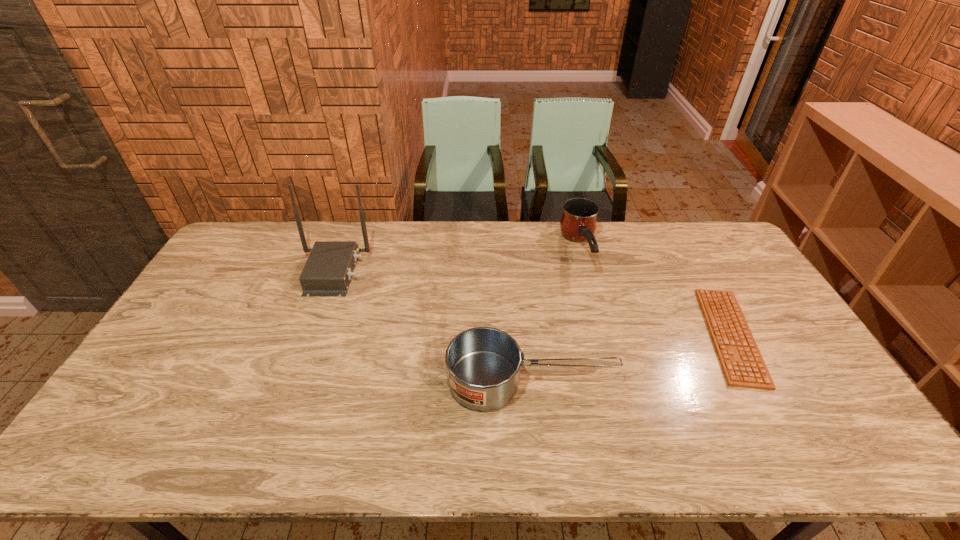
Find the location of a particular element. The height and width of the screenshot is (540, 960). the leftmost object is located at coordinates (328, 270).

This screenshot has width=960, height=540. I want to click on router, so click(x=328, y=270).

The height and width of the screenshot is (540, 960). Identify the location of the taller saucepan. (x=578, y=223).

The height and width of the screenshot is (540, 960). Find the location of `the farther saucepan`. the farther saucepan is located at coordinates (578, 223).

This screenshot has width=960, height=540. I want to click on the nearer saucepan, so click(483, 364).

Where is `the shorter saucepan`? This screenshot has height=540, width=960. the shorter saucepan is located at coordinates (483, 364).

You are a GUI agent. You are given a task and a screenshot of the screen. Output one action in this format:
    pyautogui.click(x=<x>, y=<y>)
    Task: Click on the computer keyboard
    
    Given the screenshot: What is the action you would take?
    pyautogui.click(x=743, y=366)

You are a GUI agent. You are given a task and a screenshot of the screen. Output one action in this format:
    pyautogui.click(x=<x>, y=<y>)
    Task: Click on the rightmost object
    This screenshot has height=540, width=960.
    Given the screenshot: What is the action you would take?
    pyautogui.click(x=743, y=366)

This screenshot has width=960, height=540. I want to click on free location located 0.220m on the back of the router to connect cables, so click(431, 272).

The image size is (960, 540). I want to click on free space located 0.290m on the handle side of the farther saucepan, so pos(607,350).